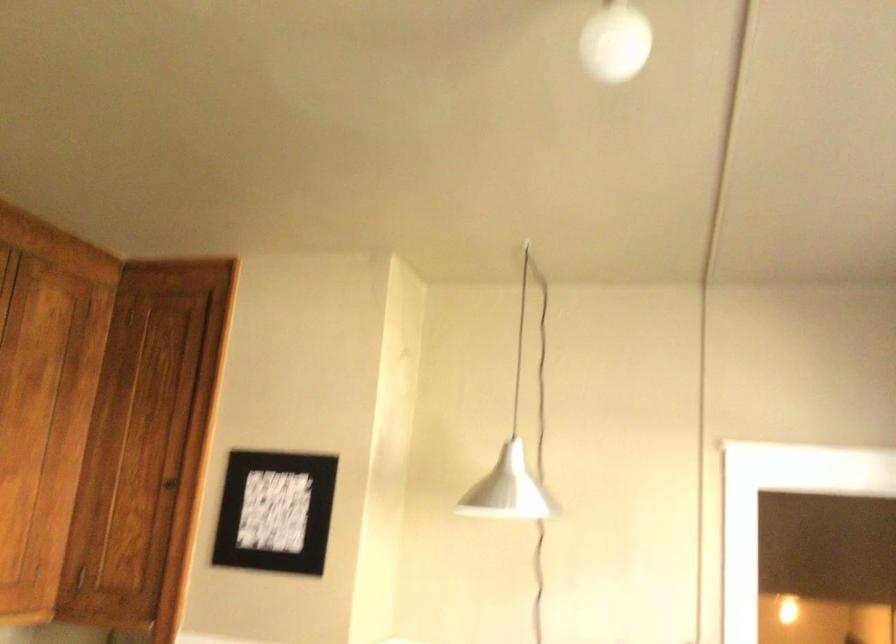
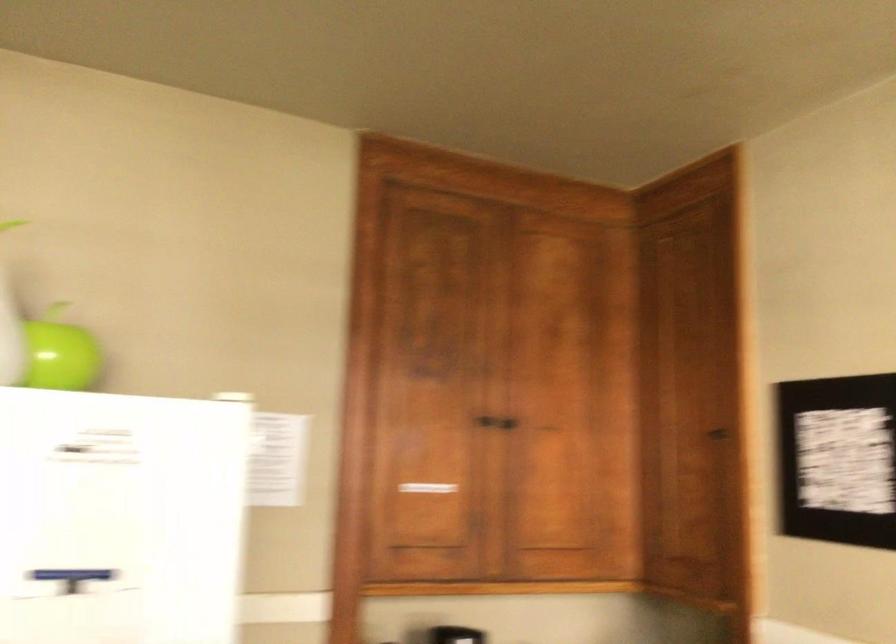
The point at (177, 484) is marked in the first image. Where is the corresponding point in the second image?

(719, 436)